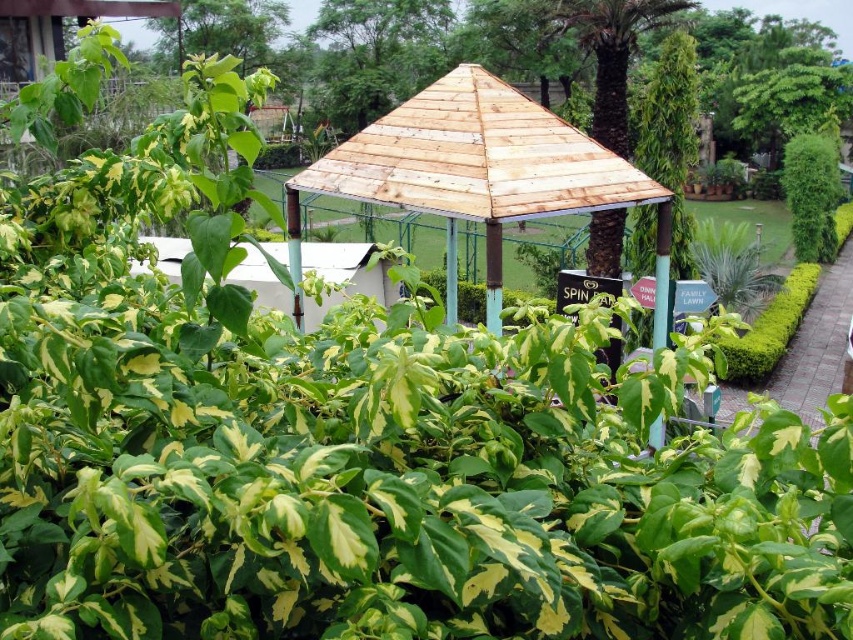
In the scene shown: You are planning to install a new lighting system in the garden. The wooden gazebo at center is where you want to place the main light fixture. The brown wooden roof at upper center is where you need to install a secondary light. Considering the distance between them, what is the minimum length of the cable you need to connect both lights without any slack?

The wooden gazebo at center and brown wooden roof at upper center are 118.78 feet apart from each other. Therefore, the minimum length of the cable required to connect both lights without any slack is 118.78 feet.

Looking at this image, you are standing at the entrance of the garden and see two points marked in the image. The first point is at coordinate point (368,3) and the second point is at coordinate point (822,260). Which point is closer to you?

Point (822,260) is closer to you because it is in front of point (368,3).

You are planning to install a new lighting system in the garden. You have two options for placement based on the objects in the scene. The first option is to place the lights on the wooden gazebo at center, and the second is to place them on the green leafy bush at upper right. Which object would require you to climb higher to install the lights?

The green leafy bush at upper right requires climbing higher because it is taller than the wooden gazebo at center.